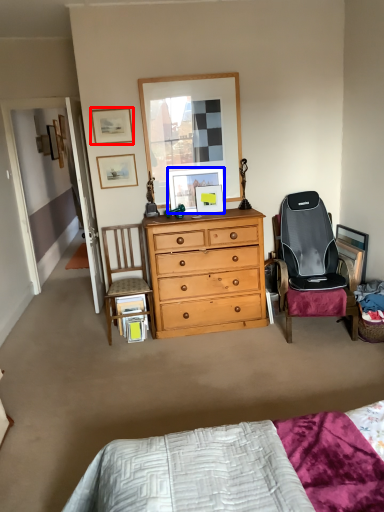
Question: Which point is further to the camera, picture frame (highlighted by a red box) or picture frame (highlighted by a blue box)?

Choices:
 (A) picture frame
 (B) picture frame

Answer: (B)